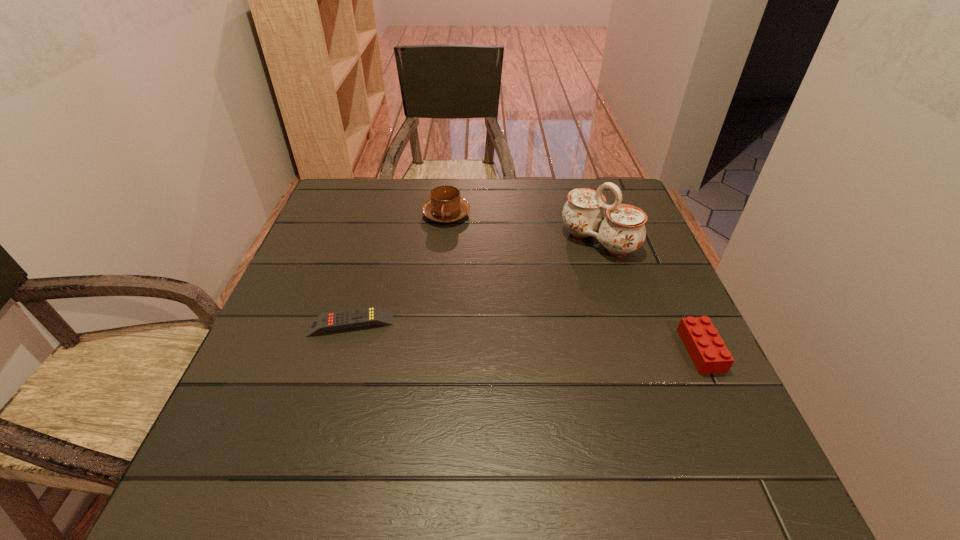
You are a GUI agent. You are given a task and a screenshot of the screen. Output one action in this format:
    pyautogui.click(x=<x>, y=<y>)
    Task: Click on the vacant space on the desktop that is between the leftmost object and the Lego and is positioned on the side of the cappuccino with the handle
    Image resolution: width=960 pixels, height=540 pixels.
    Given the screenshot: What is the action you would take?
    pyautogui.click(x=492, y=334)

Identify the location of free space on the desktop that is between the leftmost object and the Lego and is positioned by the handle of the tallest object. The height and width of the screenshot is (540, 960). (487, 334).